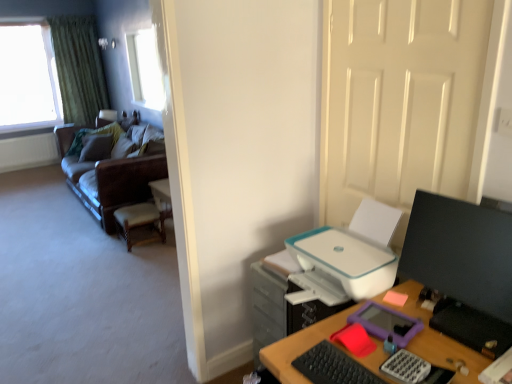
This screenshot has width=512, height=384. I want to click on transparent glass window at upper left, positioned as the 1th window in back-to-front order, so click(28, 78).

Describe the element at coordinates (79, 68) in the screenshot. The image size is (512, 384). I see `green textured curtain at upper left` at that location.

Locate an element on the screen. The height and width of the screenshot is (384, 512). white glossy door at upper right is located at coordinates click(399, 100).

You are a GUI agent. You are given a task and a screenshot of the screen. Output one action in this format:
    pyautogui.click(x=<x>, y=<y>)
    Task: Click on the brown leather couch at left
    
    Given the screenshot: What is the action you would take?
    pyautogui.click(x=108, y=179)

This screenshot has height=384, width=512. In order to click on white plastic file cabinet at lower right in this screenshot , I will do `click(281, 307)`.

Describe the element at coordinates (395, 298) in the screenshot. I see `pink matte sticky notes at right` at that location.

The height and width of the screenshot is (384, 512). In order to click on transparent glass window at upper left, which is the second window from right to left in this screenshot , I will do `click(28, 78)`.

Which is correct: green textured curtain at upper left is inside pink matte sticky notes at right, or outside of it?

green textured curtain at upper left cannot be found inside pink matte sticky notes at right.

Consider the image. How much distance is there between green textured curtain at upper left and pink matte sticky notes at right?

The distance of green textured curtain at upper left from pink matte sticky notes at right is 6.34 meters.

Is green textured curtain at upper left wider than pink matte sticky notes at right?

Yes.

Image resolution: width=512 pixels, height=384 pixels. Find the location of `stationery that appears in front of the green textured curtain at upper left`. stationery that appears in front of the green textured curtain at upper left is located at coordinates (395, 298).

Is wooden woven seat at left far from green textured curtain at upper left?

Absolutely, wooden woven seat at left is distant from green textured curtain at upper left.

Is wooden woven seat at left thinner than green textured curtain at upper left?

Incorrect, the width of wooden woven seat at left is not less than that of green textured curtain at upper left.

Considering the sizes of objects wooden woven seat at left and green textured curtain at upper left in the image provided, who is taller, wooden woven seat at left or green textured curtain at upper left?

green textured curtain at upper left is taller.

From a real-world perspective, who is located lower, wooden woven seat at left or green textured curtain at upper left?

From a 3D spatial view, wooden woven seat at left is below.

Considering the relative sizes of transparent glass window at upper left, the second window positioned from the front, and velvet green pillow at left in the image provided, is transparent glass window at upper left, the second window positioned from the front, shorter than velvet green pillow at left?

In fact, transparent glass window at upper left, the second window positioned from the front, may be taller than velvet green pillow at left.

Find the location of a particular element. pillow on the right of transparent glass window at upper left, positioned as the 1th window in back-to-front order is located at coordinates (96, 147).

Based on the photo, are transparent glass window at upper left, which appears as the 1th window when viewed from the left, and velvet green pillow at left located far from each other?

transparent glass window at upper left, which appears as the 1th window when viewed from the left, is far away from velvet green pillow at left.

Looking at the image, does transparent glass window at upper left, which is the second window from right to left, seem bigger or smaller compared to velvet green pillow at left?

transparent glass window at upper left, which is the second window from right to left, is bigger than velvet green pillow at left.

Is white glossy door at upper right behind white plastic printer at right?

No, white glossy door at upper right is closer to the camera.

Considering the positions of objects white glossy door at upper right and white plastic printer at right in the image provided, who is more to the right, white glossy door at upper right or white plastic printer at right?

From the viewer's perspective, white glossy door at upper right appears more on the right side.

Which is in front, point (421, 47) or point (383, 216)?

The point (421, 47) is in front.

Is white glossy door at upper right facing away from white plastic printer at right?

No, white glossy door at upper right's orientation is not away from white plastic printer at right.

Which object is closer to the camera taking this photo, white plastic printer at right or pink matte sticky notes at right?

white plastic printer at right is in front.

Are white plastic printer at right and pink matte sticky notes at right located far from each other?

No, white plastic printer at right is not far away from pink matte sticky notes at right.

Consider the image. Is white plastic printer at right turned away from pink matte sticky notes at right?

white plastic printer at right does not have its back to pink matte sticky notes at right.

From a real-world perspective, is black matte keyboard at lower right physically above brown leather couch at left?

Indeed, from a real-world perspective, black matte keyboard at lower right stands above brown leather couch at left.

From the image's perspective, which is above, black matte keyboard at lower right or brown leather couch at left?

brown leather couch at left, from the image's perspective.

Which object is positioned more to the left, black matte keyboard at lower right or brown leather couch at left?

brown leather couch at left.

Which object is closer to the camera, white plastic printer at right or velvet green pillow at left?

white plastic printer at right.

Considering the sizes of objects white plastic printer at right and velvet green pillow at left in the image provided, who is thinner, white plastic printer at right or velvet green pillow at left?

With smaller width is velvet green pillow at left.

From the image's perspective, is white plastic printer at right located above or below velvet green pillow at left?

From the image's perspective, white plastic printer at right appears below velvet green pillow at left.

Is white plastic printer at right bigger than velvet green pillow at left?

Correct, white plastic printer at right is larger in size than velvet green pillow at left.

This screenshot has height=384, width=512. Identify the location of curtain above the pink matte sticky notes at right (from a real-world perspective). 79,68.

Find the location of a particular element. computer chair below the green textured curtain at upper left (from the image's perspective) is located at coordinates (139, 222).

From the image, which object appears to be farther from green textured curtain at upper left, white plastic file cabinet at lower right or brown leather couch at left?

white plastic file cabinet at lower right lies further to green textured curtain at upper left than the other object.

Estimate the real-world distances between objects in this image. Which object is further from clear glass window at upper left, marked as the first window in a front-to-back arrangement, white glossy door at upper right or black glossy monitor at right?

black glossy monitor at right is positioned further to the anchor clear glass window at upper left, marked as the first window in a front-to-back arrangement.

Looking at the image, which one is located further to green textured curtain at upper left, transparent glass window at upper left, the second window positioned from the front, or wooden woven seat at left?

wooden woven seat at left lies further to green textured curtain at upper left than the other object.

Considering their positions, is transparent glass window at upper left, which is the second window from right to left, positioned closer to brown leather couch at left than pink matte sticky notes at right?

Among the two, transparent glass window at upper left, which is the second window from right to left, is located nearer to brown leather couch at left.

When comparing their distances from brown leather couch at left, does velvet green pillow at left or white plastic printer at right seem further?

Based on the image, white plastic printer at right appears to be further to brown leather couch at left.

Considering their positions, is black glossy monitor at right positioned further to white plastic file cabinet at lower right than velvet green pillow at left?

velvet green pillow at left lies further to white plastic file cabinet at lower right than the other object.

Estimate the real-world distances between objects in this image. Which object is closer to transparent glass window at upper left, positioned as the 1th window in back-to-front order, black glossy monitor at right or green textured curtain at upper left?

green textured curtain at upper left is closer to transparent glass window at upper left, positioned as the 1th window in back-to-front order.

Estimate the real-world distances between objects in this image. Which object is further from pink matte sticky notes at right, black matte keyboard at lower right or clear glass window at upper left, placed as the first window when sorted from right to left?

Among the two, clear glass window at upper left, placed as the first window when sorted from right to left, is located further to pink matte sticky notes at right.

Find the location of a particular element. file cabinet positioned between pink matte sticky notes at right and green textured curtain at upper left from near to far is located at coordinates (281, 307).

Find the location of a particular element. This screenshot has width=512, height=384. studio couch between pink matte sticky notes at right and transparent glass window at upper left, positioned as the 1th window in back-to-front order, from front to back is located at coordinates (108, 179).

Identify the location of computer chair between white glossy door at upper right and transparent glass window at upper left, the second window positioned from the front, along the z-axis. The image size is (512, 384). (139, 222).

Find the location of a particular element. window located between white plastic file cabinet at lower right and velvet green pillow at left in the depth direction is located at coordinates (145, 69).